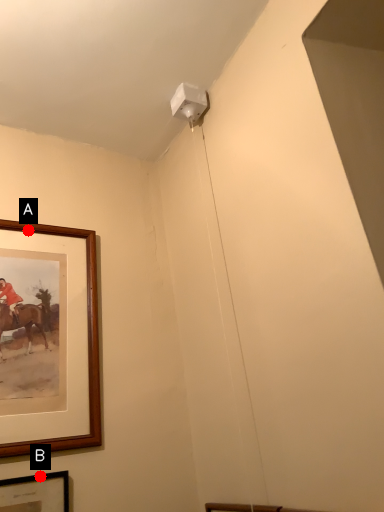
Question: Two points are circled on the image, labeled by A and B beside each circle. Which point appears closest to the camera in this image?

Choices:
 (A) A is closer
 (B) B is closer

Answer: (B)